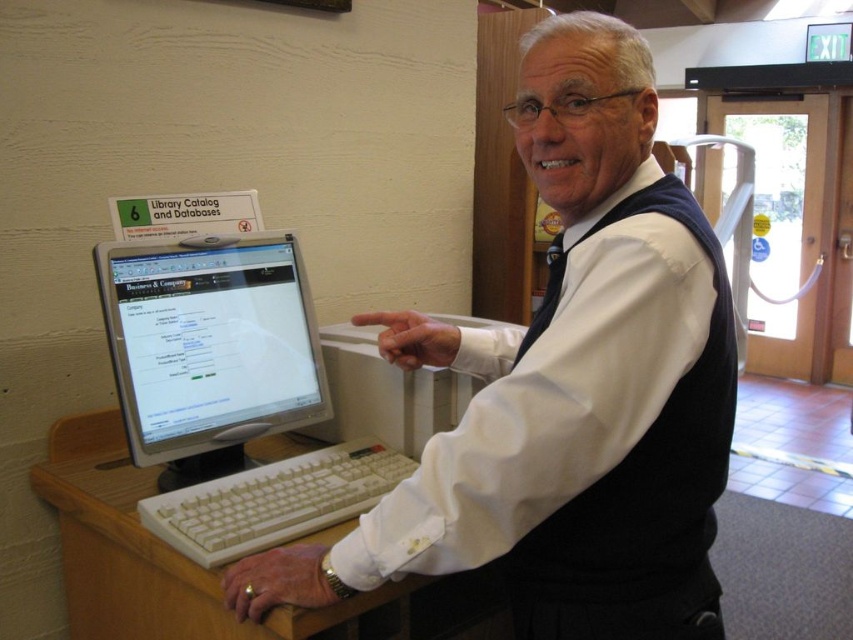
Does white glossy monitor at center appear over white plastic keyboard at lower center?

Correct, white glossy monitor at center is located above white plastic keyboard at lower center.

Which is in front, point (215, 445) or point (254, 534)?

Point (254, 534)

This screenshot has width=853, height=640. I want to click on white glossy monitor at center, so click(x=209, y=348).

Does white matte shirt at center have a lesser height compared to white plastic keyboard at lower center?

In fact, white matte shirt at center may be taller than white plastic keyboard at lower center.

Can you confirm if white matte shirt at center is bigger than white plastic keyboard at lower center?

Yes.

At what (x,y) coordinates should I click in order to perform the action: click on white matte shirt at center. Please return your answer as a coordinate pair (x, y). The image size is (853, 640). Looking at the image, I should click on (567, 388).

Does white matte shirt at center appear under white glossy monitor at center?

Incorrect, white matte shirt at center is not positioned below white glossy monitor at center.

Does white matte shirt at center have a larger size compared to white glossy monitor at center?

Yes.

Find the location of `white matte shirt at center`. white matte shirt at center is located at coordinates pyautogui.click(x=567, y=388).

Image resolution: width=853 pixels, height=640 pixels. Find the location of `white matte shirt at center`. white matte shirt at center is located at coordinates (567, 388).